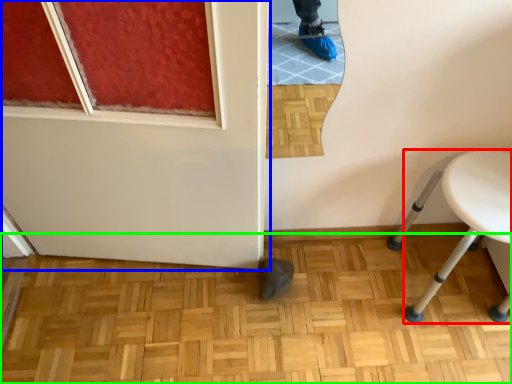
Question: Which is farther away from furniture (highlighted by a red box)? door (highlighted by a blue box) or hardwood (highlighted by a green box)?

Choices:
 (A) door
 (B) hardwood

Answer: (A)